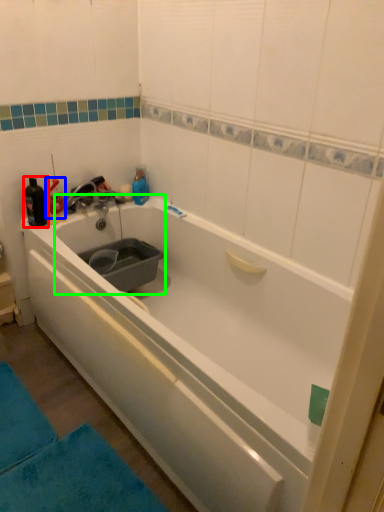
Question: Which is farther away from bottle (highlighted by a red box)? bottle (highlighted by a blue box) or sink (highlighted by a green box)?

Choices:
 (A) bottle
 (B) sink

Answer: (B)